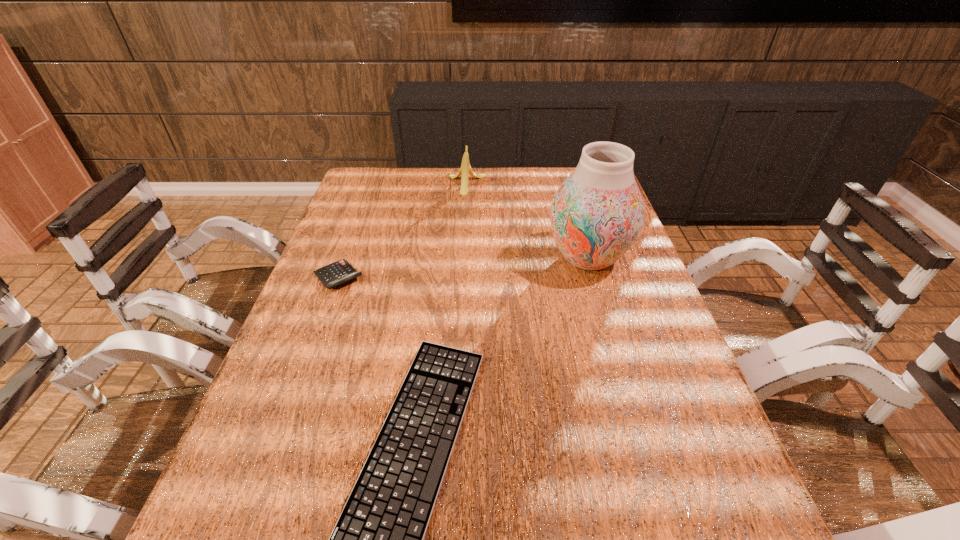
What are the coordinates of `the tallest object` in the screenshot? It's located at (597, 213).

Find the location of `the rightmost object`. the rightmost object is located at coordinates (597, 213).

Where is `banana`? banana is located at coordinates pos(465,170).

Locate an element on the screen. the farthest object is located at coordinates (465, 170).

Identify the location of calculator. (x=341, y=271).

The image size is (960, 540). In order to click on the leftmost object in this screenshot , I will do `click(341, 271)`.

This screenshot has width=960, height=540. In order to click on free location located 0.320m on the back of the tallest object in this screenshot , I will do point(565,181).

Identify the location of vacant point located on the front of the farthest object. The image size is (960, 540). (464, 237).

Image resolution: width=960 pixels, height=540 pixels. I want to click on vacant space located 0.220m on the back of the third tallest object, so point(361,217).

You are a GUI agent. You are given a task and a screenshot of the screen. Output one action in this format:
    pyautogui.click(x=<x>, y=<y>)
    Task: Click on the object at the far edge
    The width and height of the screenshot is (960, 540).
    Given the screenshot: What is the action you would take?
    pyautogui.click(x=465, y=170)